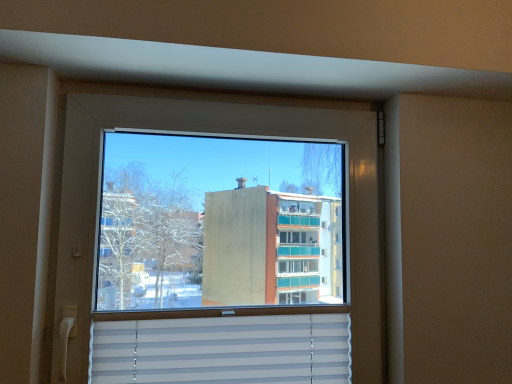
This screenshot has width=512, height=384. Identify the location of white plastic blinds at bottom. (224, 350).

The width and height of the screenshot is (512, 384). What do you see at coordinates (224, 350) in the screenshot? I see `white plastic blinds at bottom` at bounding box center [224, 350].

Measure the distance between point (73, 230) and camera.

They are 37.83 inches apart.

Find the location of a particular element. This screenshot has height=384, width=512. transparent glass window at center is located at coordinates (216, 132).

Describe the element at coordinates (216, 132) in the screenshot. The height and width of the screenshot is (384, 512). I see `transparent glass window at center` at that location.

You are a GUI agent. You are given a task and a screenshot of the screen. Output one action in this format:
    pyautogui.click(x=<x>, y=<y>)
    Task: Click on the white plastic blinds at bottom
    This screenshot has height=384, width=512.
    Given the screenshot: What is the action you would take?
    pyautogui.click(x=224, y=350)

Is white plastic blinds at bottom at the left side of transparent glass window at center?

Correct, you'll find white plastic blinds at bottom to the left of transparent glass window at center.

Which object is more forward, white plastic blinds at bottom or transparent glass window at center?

Positioned in front is transparent glass window at center.

Does point (280, 343) come closer to viewer compared to point (251, 108)?

Yes, point (280, 343) is in front of point (251, 108).

From the image's perspective, is white plastic blinds at bottom located above or below transparent glass window at center?

white plastic blinds at bottom is situated lower than transparent glass window at center in the image.

From a real-world perspective, is white plastic blinds at bottom physically above transparent glass window at center?

Actually, white plastic blinds at bottom is physically below transparent glass window at center in the real world.

Considering the relative sizes of white plastic blinds at bottom and transparent glass window at center in the image provided, is white plastic blinds at bottom wider than transparent glass window at center?

Incorrect, the width of white plastic blinds at bottom does not surpass that of transparent glass window at center.

Which of these two, white plastic blinds at bottom or transparent glass window at center, stands taller?

transparent glass window at center is taller.

In the scene shown: Does white plastic blinds at bottom have a smaller size compared to transparent glass window at center?

Indeed, white plastic blinds at bottom has a smaller size compared to transparent glass window at center.

Is white plastic blinds at bottom not inside transparent glass window at center?

No, white plastic blinds at bottom is inside or overlapping with transparent glass window at center.

Is white plastic blinds at bottom far away from transparent glass window at center?

No, there isn't a large distance between white plastic blinds at bottom and transparent glass window at center.

Is white plastic blinds at bottom looking in the opposite direction of transparent glass window at center?

That's right, white plastic blinds at bottom is facing away from transparent glass window at center.

Can you tell me how much white plastic blinds at bottom and transparent glass window at center differ in facing direction?

The facing directions of white plastic blinds at bottom and transparent glass window at center are 0.00103 degrees apart.

I want to click on window above the white plastic blinds at bottom (from a real-world perspective), so click(x=216, y=132).

Between transparent glass window at center and white plastic blinds at bottom, which one appears on the right side from the viewer's perspective?

transparent glass window at center.

Considering the positions of objects transparent glass window at center and white plastic blinds at bottom in the image provided, who is behind, transparent glass window at center or white plastic blinds at bottom?

white plastic blinds at bottom is further away from the camera.

Does point (85, 94) come in front of point (240, 380)?

Yes, point (85, 94) is closer to viewer.

From the image's perspective, which is above, transparent glass window at center or white plastic blinds at bottom?

transparent glass window at center.

From a real-world perspective, is transparent glass window at center under white plastic blinds at bottom?

Actually, transparent glass window at center is physically above white plastic blinds at bottom in the real world.

Considering the sizes of transparent glass window at center and white plastic blinds at bottom in the image, is transparent glass window at center wider or thinner than white plastic blinds at bottom?

Considering their sizes, transparent glass window at center looks broader than white plastic blinds at bottom.

Is transparent glass window at center taller or shorter than white plastic blinds at bottom?

Considering their sizes, transparent glass window at center has more height than white plastic blinds at bottom.

Between transparent glass window at center and white plastic blinds at bottom, which one has larger size?

transparent glass window at center is bigger.

Is transparent glass window at center spatially inside white plastic blinds at bottom, or outside of it?

transparent glass window at center exists outside the volume of white plastic blinds at bottom.

Is transparent glass window at center far from white plastic blinds at bottom?

No, transparent glass window at center is not far from white plastic blinds at bottom.

Does transparent glass window at center turn towards white plastic blinds at bottom?

Yes.

Measure the distance from transparent glass window at center to white plastic blinds at bottom.

transparent glass window at center and white plastic blinds at bottom are 8.60 inches apart from each other.

In the image, there is a transparent glass window at center. Find the location of `shutter below it (from a real-world perspective)`. shutter below it (from a real-world perspective) is located at coordinates (224, 350).

I want to click on window above the white plastic blinds at bottom (from a real-world perspective), so click(x=216, y=132).

In order to click on shutter located below the transparent glass window at center (from the image's perspective) in this screenshot , I will do `click(224, 350)`.